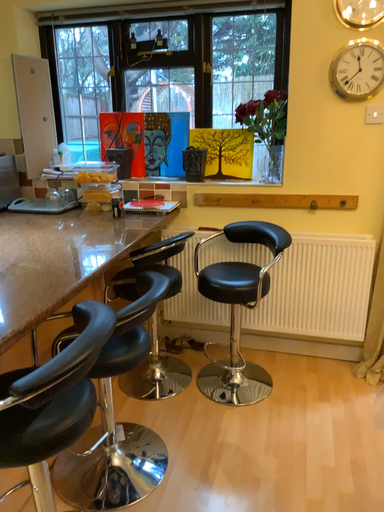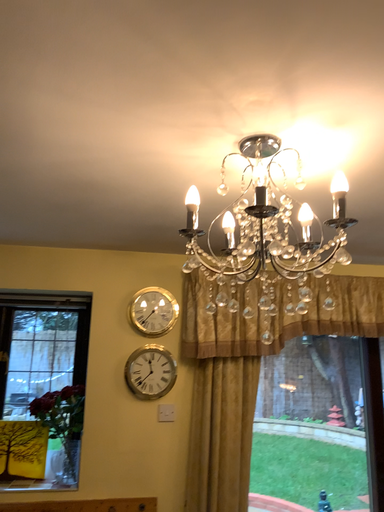
Question: Which way did the camera rotate in the video?

Choices:
 (A) rotated upward
 (B) rotated downward

Answer: (A)